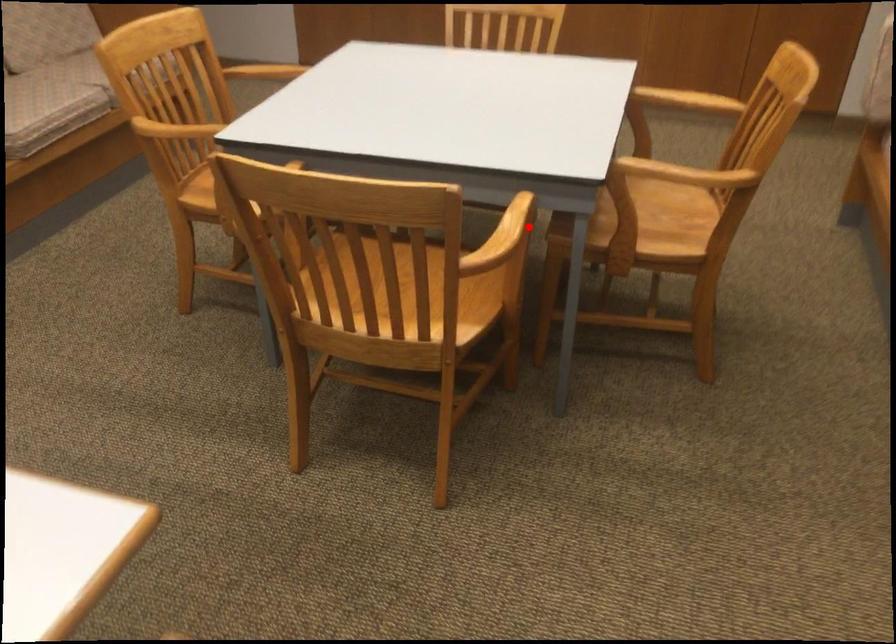
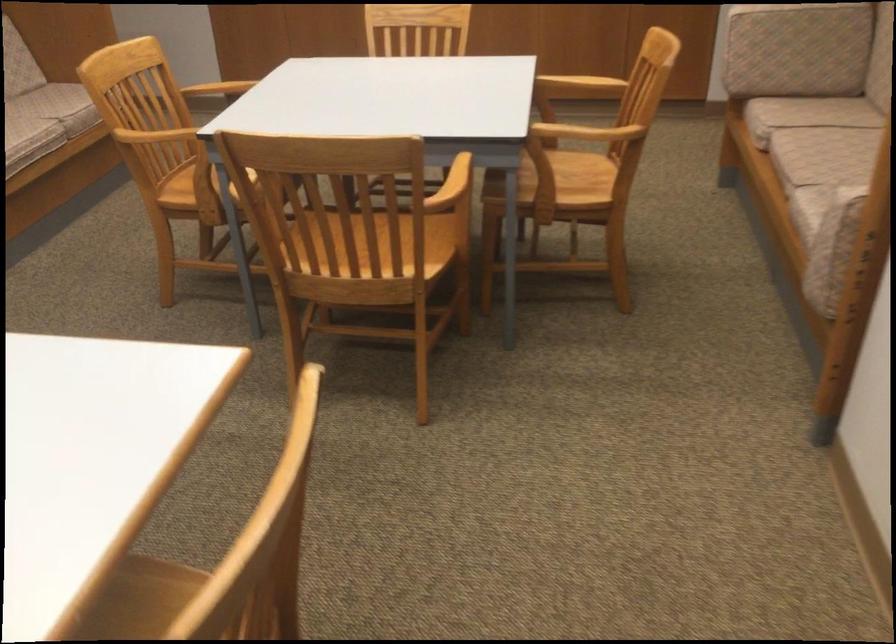
Locate, in the second image, the point that corresponds to the highlighted location in the first image.

(470, 174)